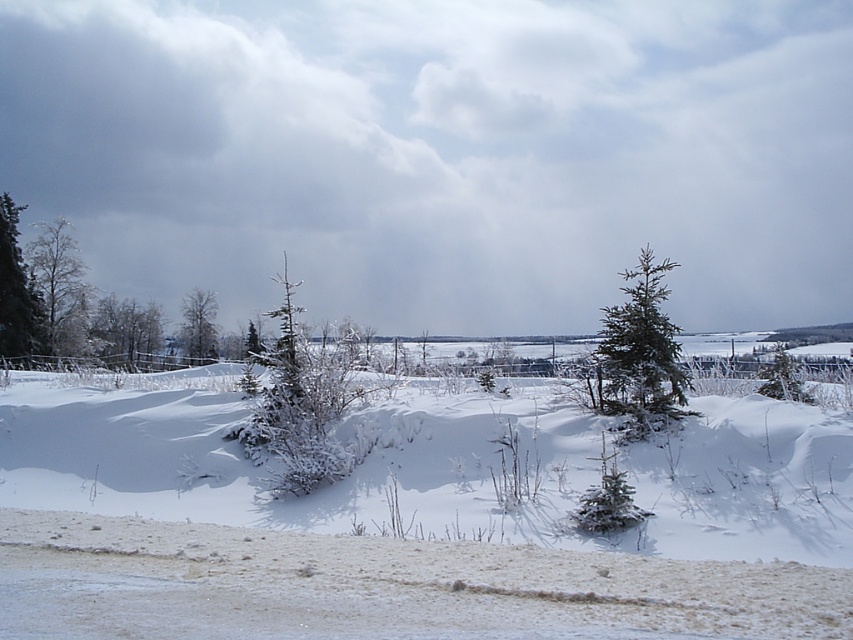
You are an environmental scientist assessing the snow load on trees in a winter landscape. You observe the green matte evergreen tree at left and the green matte tree at center. Which tree would you expect to have branches bending more under the snow weight, and why?

The green matte evergreen tree at left has a larger size compared to the green matte tree at center. Since larger trees typically have more branches and surface area, they can accumulate more snow, leading to greater bending of branches under the weight.

You are an environmental scientist assessing the health of trees in a winter landscape. You observe the green matte evergreen tree at left and the green matte tree at center. Which tree has a wider spread of branches?

The green matte evergreen tree at left has a wider spread of branches than the green matte tree at center, as its width surpasses the latter.